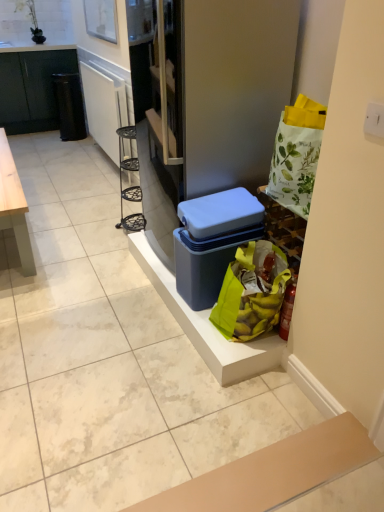
Question: Is point (76, 96) positioned closer to the camera than point (203, 290)?

Choices:
 (A) closer
 (B) farther

Answer: (B)

Question: Is black plastic trash can at left in front of or behind blue plastic storage box at center in the image?

Choices:
 (A) front
 (B) behind

Answer: (B)

Question: Which object is positioned farthest from the matte white fridge at center?

Choices:
 (A) banana-patterned fabric bag at lower right
 (B) blue plastic storage box at center
 (C) black plastic trash can at left
 (D) black matte cabinet at left

Answer: (D)

Question: Which is nearer to the black plastic trash can at left?

Choices:
 (A) matte white fridge at center
 (B) blue plastic storage box at center
 (C) banana-patterned fabric bag at lower right
 (D) black matte cabinet at left

Answer: (D)